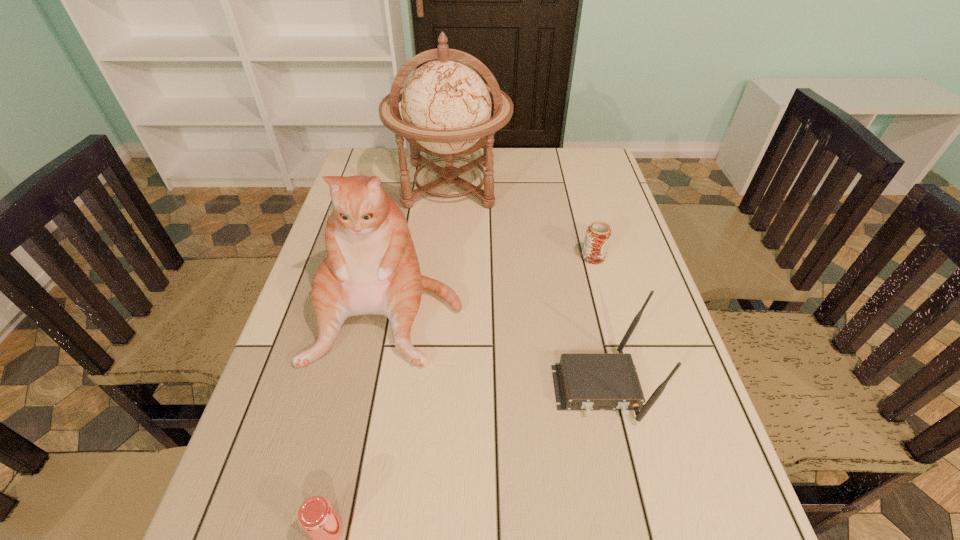
Find the location of a particular element. unoccupied area between the right beer can and the tallest object is located at coordinates (522, 221).

You are a GUI agent. You are given a task and a screenshot of the screen. Output one action in this format:
    pyautogui.click(x=<x>, y=<y>)
    Task: Click on the free area in between the cat and the farthest object
    This screenshot has height=540, width=960.
    Given the screenshot: What is the action you would take?
    pyautogui.click(x=420, y=246)

Locate an element on the screen. free space between the router and the fourth shortest object is located at coordinates pos(493,347).

Where is `the closest object to the fourth shortest object`? Image resolution: width=960 pixels, height=540 pixels. the closest object to the fourth shortest object is located at coordinates (446, 106).

Locate which object is the third closest to the globe. Please provide its 2D coordinates. Your answer should be formatted as a tuple, i.e. [(x, y)], where the tuple contains the x and y coordinates of a point satisfying the conditions above.

[(583, 381)]

This screenshot has width=960, height=540. I want to click on vacant space that satisfies the following two spatial constraints: 1. on the front-facing side of the right beer can; 2. on the right side of the tallest object, so click(x=444, y=257).

Locate an element on the screen. The height and width of the screenshot is (540, 960). blank area in the image that satisfies the following two spatial constraints: 1. on the front-facing side of the tallest object; 2. on the left side of the farther beer can is located at coordinates tap(444, 257).